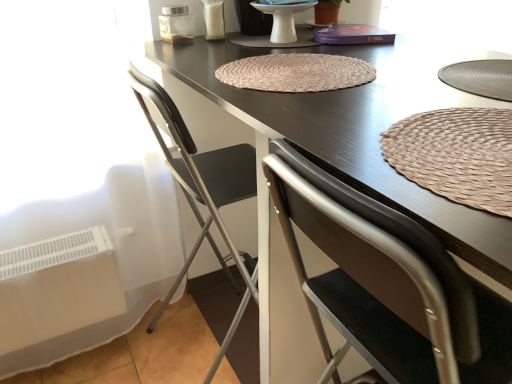
Question: Considering the relative sizes of dark brown wood table at center and brown woven mat at center, arranged as the first mat when viewed from the top, in the image provided, is dark brown wood table at center thinner than brown woven mat at center, arranged as the first mat when viewed from the top,?

Choices:
 (A) no
 (B) yes

Answer: (A)

Question: Is dark brown wood table at center turned away from brown woven mat at center, arranged as the first mat when viewed from the top?

Choices:
 (A) no
 (B) yes

Answer: (A)

Question: From a real-world perspective, is dark brown wood table at center on top of brown woven mat at center, the second mat viewed from the front?

Choices:
 (A) no
 (B) yes

Answer: (A)

Question: Is dark brown wood table at center further to camera compared to brown woven mat at center, placed as the first mat when sorted from back to front?

Choices:
 (A) no
 (B) yes

Answer: (A)

Question: Can you confirm if dark brown wood table at center is positioned to the right of brown woven mat at center, the second mat viewed from the front?

Choices:
 (A) no
 (B) yes

Answer: (B)

Question: In the image, is metallic gray chair at left positioned in front of or behind matte ceramic plate at center?

Choices:
 (A) behind
 (B) front

Answer: (B)

Question: Looking at their shapes, would you say metallic gray chair at left is wider or thinner than matte ceramic plate at center?

Choices:
 (A) wide
 (B) thin

Answer: (A)

Question: In terms of height, does metallic gray chair at left look taller or shorter compared to matte ceramic plate at center?

Choices:
 (A) tall
 (B) short

Answer: (A)

Question: From a real-world perspective, is metallic gray chair at left above or below matte ceramic plate at center?

Choices:
 (A) above
 (B) below

Answer: (B)

Question: Is dark brown wood table at center to the left or to the right of brown woven mat at center, arranged as the first mat when viewed from the top, in the image?

Choices:
 (A) right
 (B) left

Answer: (A)

Question: From a real-world perspective, is dark brown wood table at center physically located above or below brown woven mat at center, placed as the first mat when sorted from back to front?

Choices:
 (A) above
 (B) below

Answer: (B)

Question: Which is correct: dark brown wood table at center is inside brown woven mat at center, the second mat ordered from the bottom, or outside of it?

Choices:
 (A) outside
 (B) inside

Answer: (A)

Question: From the image's perspective, relative to brown woven mat at center, placed as the first mat when sorted from back to front, is dark brown wood table at center above or below?

Choices:
 (A) above
 (B) below

Answer: (B)

Question: Is brown woven mat at center, the second mat ordered from the bottom, to the left or to the right of matte ceramic plate at center in the image?

Choices:
 (A) right
 (B) left

Answer: (A)

Question: In terms of height, does brown woven mat at center, placed as the first mat when sorted from back to front, look taller or shorter compared to matte ceramic plate at center?

Choices:
 (A) short
 (B) tall

Answer: (A)